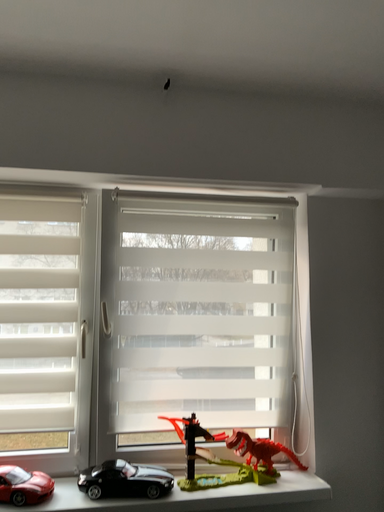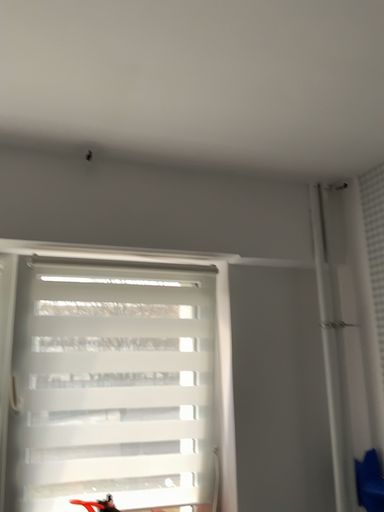
Question: How did the camera likely rotate when shooting the video?

Choices:
 (A) rotated left
 (B) rotated right

Answer: (B)